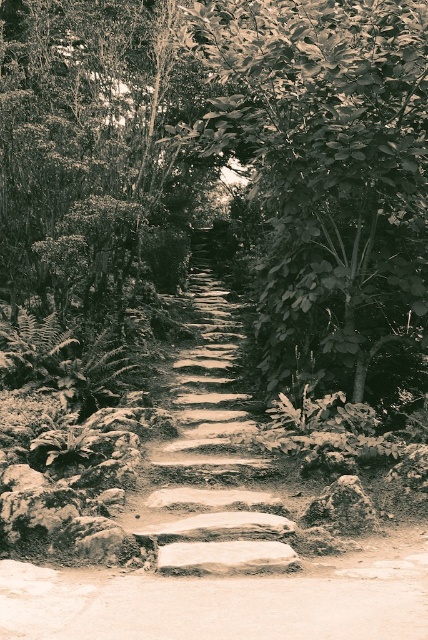
Between leathery green leafy tree at center and smooth gray rock at lower right, which one has more height?

leathery green leafy tree at center

Is point (354, 243) positioned after point (333, 490)?

Yes, point (354, 243) is behind point (333, 490).

Is point (389, 244) behind point (341, 525)?

Yes, point (389, 244) is farther from viewer.

Locate an element on the screen. leathery green leafy tree at center is located at coordinates (326, 166).

Describe the element at coordinates (214, 461) in the screenshot. I see `smooth stone steps at center` at that location.

This screenshot has height=640, width=428. Describe the element at coordinates (214, 461) in the screenshot. I see `smooth stone steps at center` at that location.

Where is `smooth stone steps at center`? smooth stone steps at center is located at coordinates (214, 461).

Who is lower down, leathery green leafy tree at center or smooth stone steps at center?

Positioned lower is smooth stone steps at center.

Is leathery green leafy tree at center further to camera compared to smooth stone steps at center?

Yes, leathery green leafy tree at center is behind smooth stone steps at center.

Where is `leathery green leafy tree at center`? Image resolution: width=428 pixels, height=640 pixels. leathery green leafy tree at center is located at coordinates (326, 166).

What are the coordinates of `leathery green leafy tree at center` in the screenshot? It's located at pyautogui.click(x=326, y=166).